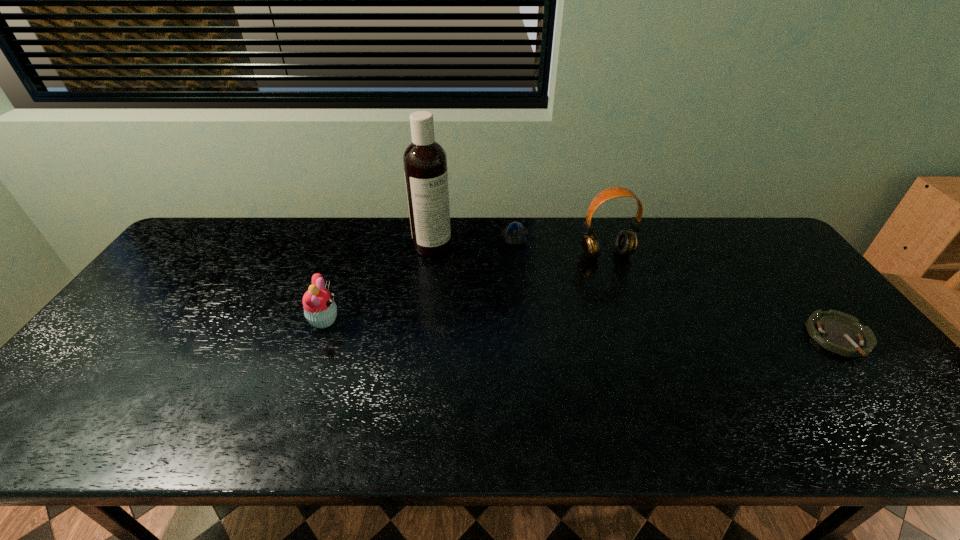
Where is `blank area located on the face of the leftmost object`? The height and width of the screenshot is (540, 960). blank area located on the face of the leftmost object is located at coordinates (387, 320).

Where is `free space located 0.060m on the left of the shortest object`? The height and width of the screenshot is (540, 960). free space located 0.060m on the left of the shortest object is located at coordinates (787, 337).

You are a GUI agent. You are given a task and a screenshot of the screen. Output one action in this format:
    pyautogui.click(x=<x>, y=<y>)
    Task: Click on the free location located on the ear cups of the second object from right to left
    The height and width of the screenshot is (540, 960).
    Given the screenshot: What is the action you would take?
    pyautogui.click(x=631, y=294)

Locate an element on the screen. vacant space located on the ear cups of the second object from right to left is located at coordinates (661, 347).

Where is `vacant area situated on the ear cups of the second object from right to left`? This screenshot has width=960, height=540. vacant area situated on the ear cups of the second object from right to left is located at coordinates (627, 287).

Find the location of `free space located 0.320m on the button side of the computer mouse`. free space located 0.320m on the button side of the computer mouse is located at coordinates (506, 319).

Locate an element on the screen. The height and width of the screenshot is (540, 960). free space located 0.130m on the button side of the computer mouse is located at coordinates (512, 274).

Locate an element on the screen. Image resolution: width=960 pixels, height=540 pixels. vacant space positioned 0.380m on the button side of the computer mouse is located at coordinates (504, 335).

At what (x,y) coordinates should I click in order to perform the action: click on blank space located on the label side of the fourth object from right to left. Please return your answer as a coordinate pair (x, y). This screenshot has height=540, width=960. Looking at the image, I should click on (512, 295).

Where is `vacant space located on the label side of the fourth object from right to left`? The image size is (960, 540). vacant space located on the label side of the fourth object from right to left is located at coordinates (461, 263).